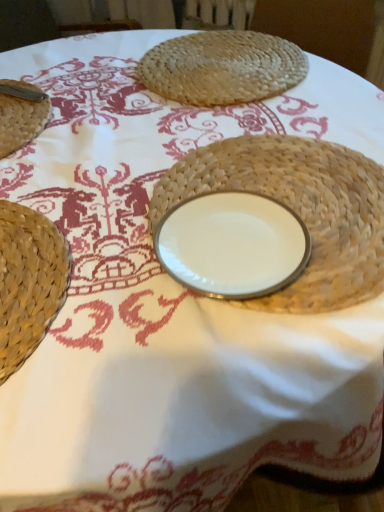
Question: Is woven straw plate at center completely or partially outside of white porcelain plate at center?

Choices:
 (A) no
 (B) yes

Answer: (B)

Question: From the image's perspective, is woven straw plate at center beneath white porcelain plate at center?

Choices:
 (A) yes
 (B) no

Answer: (B)

Question: Are woven straw plate at center and white porcelain plate at center beside each other?

Choices:
 (A) yes
 (B) no

Answer: (A)

Question: From the image's perspective, would you say woven straw plate at center is positioned over white porcelain plate at center?

Choices:
 (A) yes
 (B) no

Answer: (A)

Question: Is woven straw plate at center not near white porcelain plate at center?

Choices:
 (A) no
 (B) yes

Answer: (A)

Question: Is woven straw placemat at upper center in front of or behind woven straw plate at center in the image?

Choices:
 (A) behind
 (B) front

Answer: (A)

Question: From their relative heights in the image, would you say woven straw placemat at upper center is taller or shorter than woven straw plate at center?

Choices:
 (A) short
 (B) tall

Answer: (B)

Question: From a real-world perspective, is woven straw placemat at upper center positioned above or below woven straw plate at center?

Choices:
 (A) above
 (B) below

Answer: (A)

Question: Is woven straw placemat at upper center bigger or smaller than woven straw plate at center?

Choices:
 (A) big
 (B) small

Answer: (B)

Question: Does point pos(377,281) appear closer or farther from the camera than point pos(281,84)?

Choices:
 (A) farther
 (B) closer

Answer: (B)

Question: In the image, is woven straw plate at center positioned in front of or behind woven straw placemat at upper center?

Choices:
 (A) front
 (B) behind

Answer: (A)

Question: Choose the correct answer: Is woven straw plate at center inside woven straw placemat at upper center or outside it?

Choices:
 (A) inside
 (B) outside

Answer: (B)

Question: Considering the positions of woven straw plate at center and woven straw placemat at upper center in the image, is woven straw plate at center bigger or smaller than woven straw placemat at upper center?

Choices:
 (A) small
 (B) big

Answer: (B)

Question: Considering their positions, is white porcelain plate at center located in front of or behind woven straw placemat at upper center?

Choices:
 (A) behind
 (B) front

Answer: (B)

Question: Is white porcelain plate at center situated inside woven straw placemat at upper center or outside?

Choices:
 (A) outside
 (B) inside

Answer: (A)